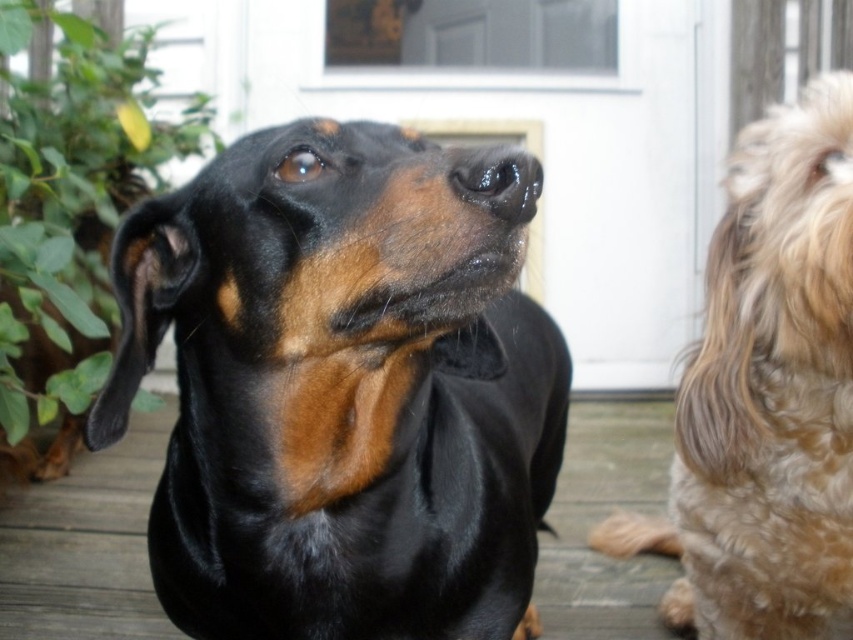
You are a photographer trying to capture both the black shiny dog at center and the black smooth deck at center in a single shot. Based on their sizes, which object would you need to frame more carefully to ensure it doesn

The black shiny dog at center occupies less space than the black smooth deck at center, so you should frame the black shiny dog at center more carefully to ensure it is properly captured in the photo.

You are standing on the wooden deck and want to enter the house through the white matte screen door at upper center. To do so, you need to step over the two dogs. Which dog do you need to step over first, the black and tan dachshund in the foreground or the light brown fluffy dog partially visible on the right?

You need to step over the black and tan dachshund in the foreground first because it is closer to you than the light brown fluffy dog partially visible on the right.